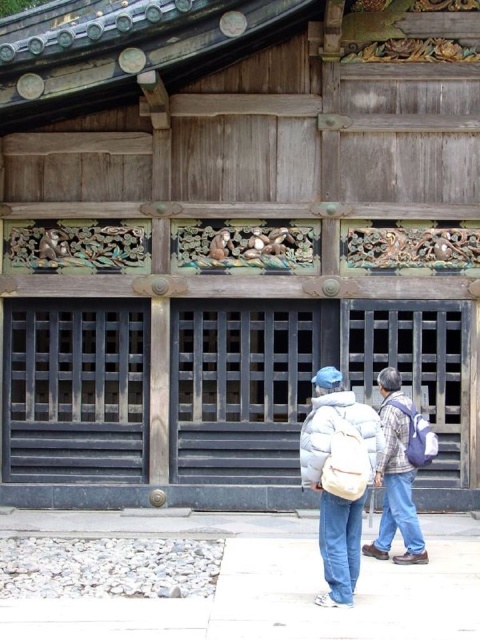
You are standing in front of a traditional Japanese shrine and see a person wearing a white matte jacket at center and light blue denim jeans at center. Which clothing item is closer to you?

The white matte jacket at center is closer to you because it is in front of the light blue denim jeans at center.

You are a photographer trying to capture a clear shot of the shrine. The white matte jacket at center and the blue fabric backpack at right are blocking your view. Which object is closer to the photographer so that you can ask them to move first?

The white matte jacket at center is positioned under the blue fabric backpack at right, meaning it is closer to the photographer. Therefore, you should ask the person wearing the white matte jacket at center to move first to unblock the view.